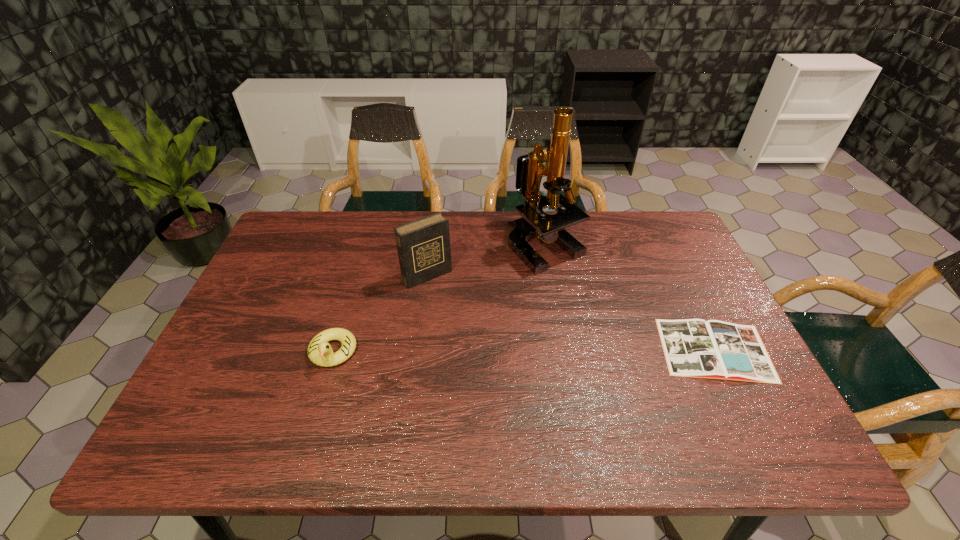
I want to click on free space on the desktop that is between the third tallest object and the rightmost object and is positioned on the front cover of the second tallest object, so click(487, 351).

Locate an element on the screen. The width and height of the screenshot is (960, 540). free space on the desktop that is between the third tallest object and the shortest object and is positioned at the eyepiece of the third object from left to right is located at coordinates (580, 350).